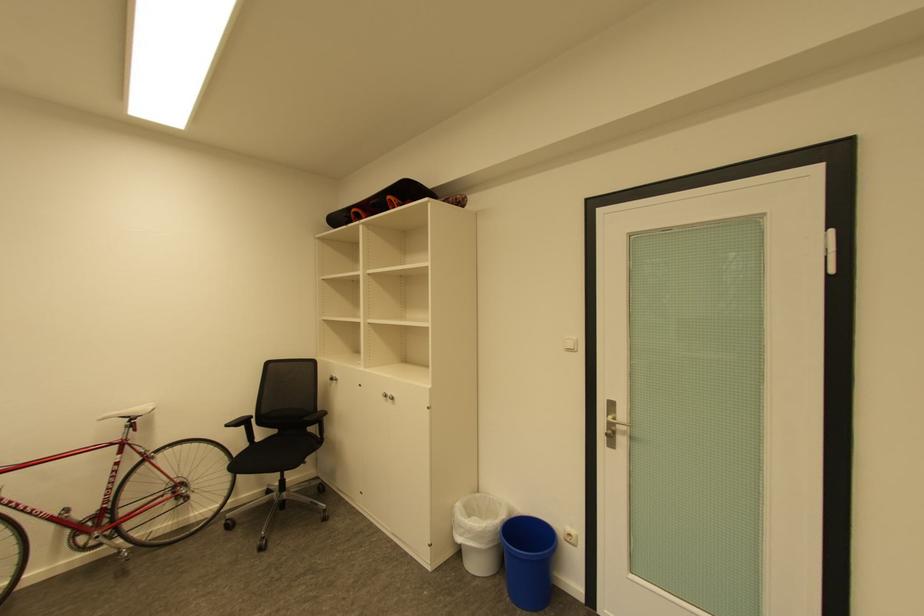
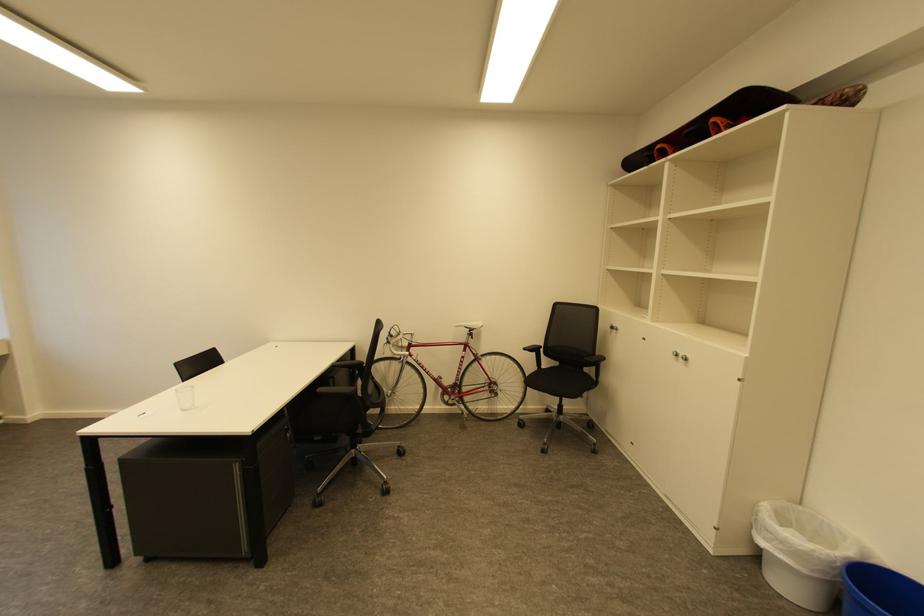
Locate, in the second image, the point that corresponds to pixel 264 440 in the first image.

(551, 368)